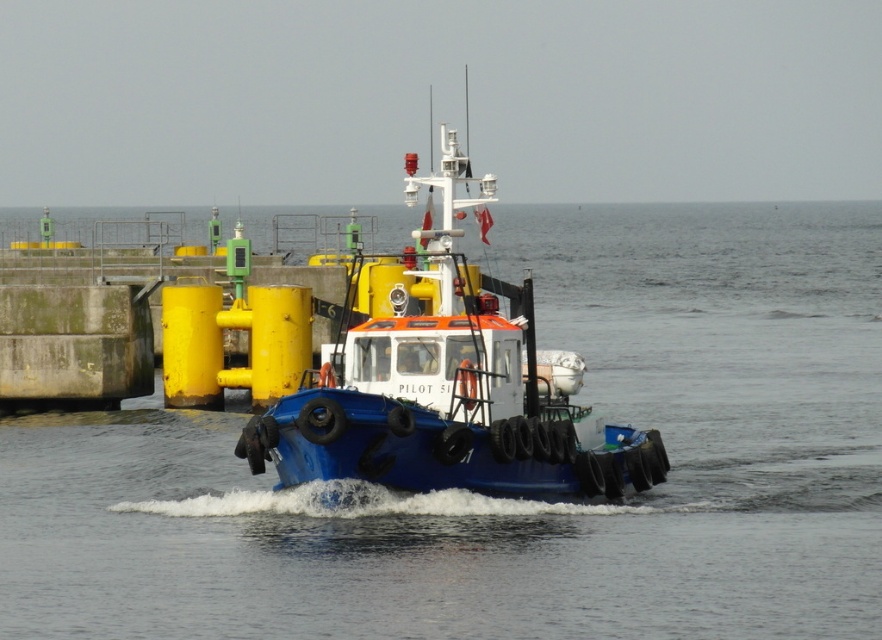
Does blue water at center have a greater height compared to blue rubber boat at center?

Yes.

Does blue water at center have a smaller size compared to blue rubber boat at center?

No.

Is point (726, 461) closer to viewer compared to point (492, 490)?

No, (726, 461) is behind (492, 490).

Image resolution: width=882 pixels, height=640 pixels. Identify the location of blue water at center. (509, 499).